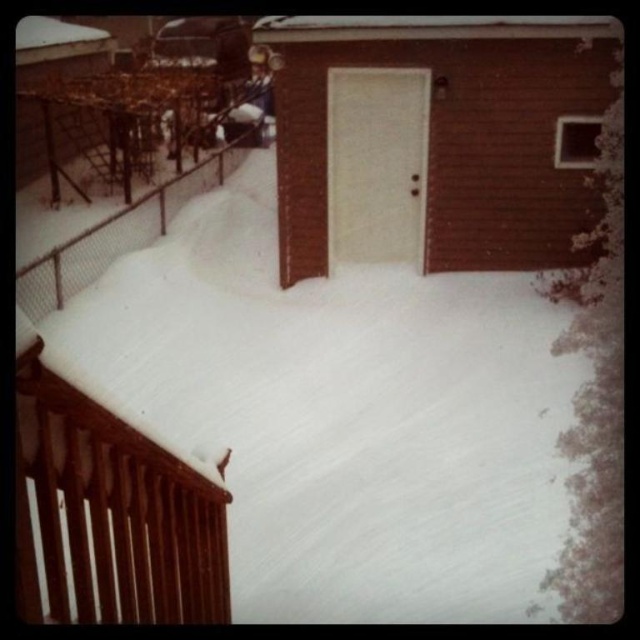
Does brown wooden balustrade at lower left have a lesser height compared to wire mesh fence at left?

In fact, brown wooden balustrade at lower left may be taller than wire mesh fence at left.

Where is `brown wooden balustrade at lower left`? This screenshot has height=640, width=640. brown wooden balustrade at lower left is located at coordinates (116, 506).

Who is positioned more to the left, white fluffy snow at lower center or wire mesh fence at left?

From the viewer's perspective, wire mesh fence at left appears more on the left side.

Is white fluffy snow at lower center below wire mesh fence at left?

Yes.

What do you see at coordinates (321, 282) in the screenshot? The image size is (640, 640). I see `white fluffy snow at lower center` at bounding box center [321, 282].

You are a GUI agent. You are given a task and a screenshot of the screen. Output one action in this format:
    pyautogui.click(x=<x>, y=<y>)
    Task: Click on the white fluffy snow at lower center
    Image resolution: width=640 pixels, height=640 pixels.
    Given the screenshot: What is the action you would take?
    pyautogui.click(x=321, y=282)

In the scene shown: Can you confirm if brown wooden balustrade at lower left is shorter than white fluffy snow at lower center?

Yes.

Who is more distant from viewer, (x=122, y=600) or (x=362, y=278)?

Point (x=362, y=278)

Find the location of `brown wooden balustrade at lower left`. brown wooden balustrade at lower left is located at coordinates (116, 506).

Where is `brown wooden balustrade at lower left`? Image resolution: width=640 pixels, height=640 pixels. brown wooden balustrade at lower left is located at coordinates (116, 506).